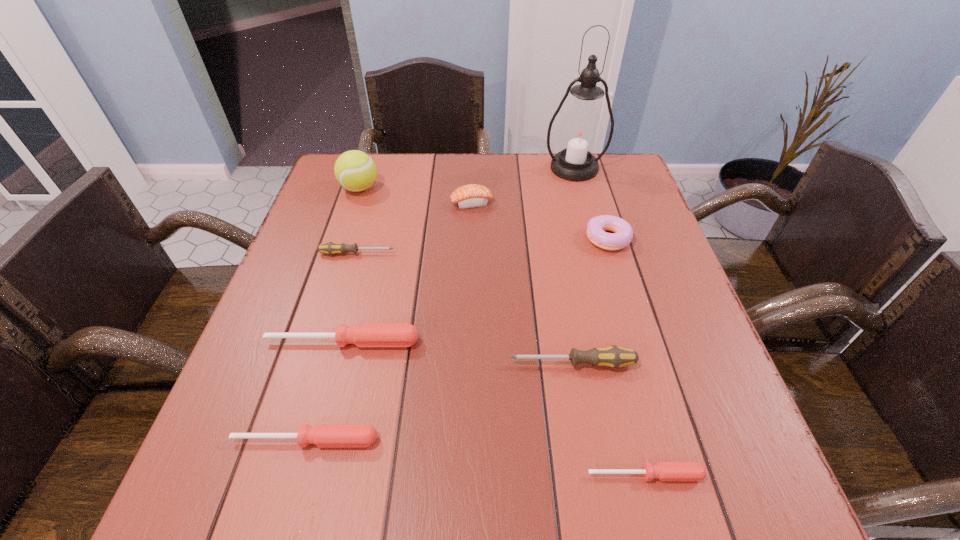
You are a GUI agent. You are given a task and a screenshot of the screen. Output one action in this format:
    pyautogui.click(x=<x>, y=<y>)
    Task: Click on the object at the near edge
    The image size is (960, 540).
    Given the screenshot: What is the action you would take?
    pyautogui.click(x=665, y=471)

At what (x,y) coordinates should I click in order to perform the action: click on tennis ball present at the left edge. Please return your answer as a coordinate pair (x, y). This screenshot has width=960, height=540. Looking at the image, I should click on (354, 170).

This screenshot has height=540, width=960. What are the coordinates of `oil lamp present at the right edge` in the screenshot? It's located at (580, 133).

Where is `doughnut at the right edge`? doughnut at the right edge is located at coordinates (623, 233).

Locate an element on the screen. The image size is (960, 540). object at the far left corner is located at coordinates (354, 170).

At what (x,y) coordinates should I click in order to perform the action: click on object located in the far right corner section of the desktop. Please return your answer as a coordinate pair (x, y). The width and height of the screenshot is (960, 540). Looking at the image, I should click on (580, 133).

This screenshot has width=960, height=540. Find the location of `object that is at the near right corner`. object that is at the near right corner is located at coordinates tap(665, 471).

At what (x,y) coordinates should I click in order to perform the action: click on vacant space at the far edge. Please return your answer as a coordinate pair (x, y). The image size is (960, 540). Looking at the image, I should click on (391, 167).

This screenshot has width=960, height=540. I want to click on vacant region at the near edge, so click(512, 481).

The image size is (960, 540). Find the location of `vacant space at the left edge of the desktop`. vacant space at the left edge of the desktop is located at coordinates (311, 338).